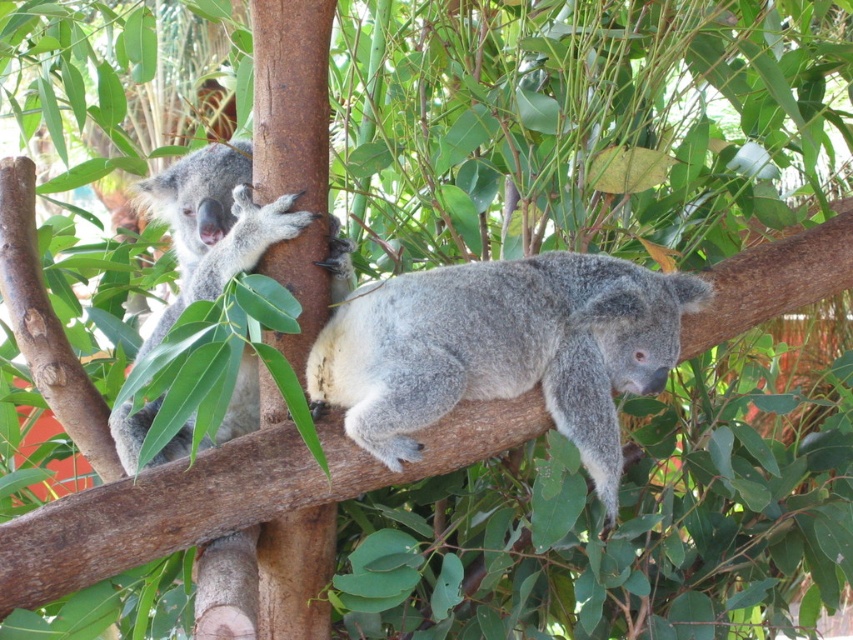
Can you confirm if gray furry koala at center is taller than gray furry koala at left?

No.

Based on the photo, is gray furry koala at center to the right of gray furry koala at left from the viewer's perspective?

Indeed, gray furry koala at center is positioned on the right side of gray furry koala at left.

This screenshot has height=640, width=853. I want to click on gray furry koala at center, so click(x=503, y=349).